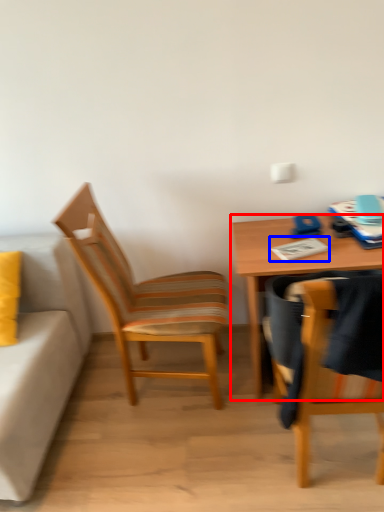
Question: Which point is closer to the camera, desk (highlighted by a red box) or notepad (highlighted by a blue box)?

Choices:
 (A) desk
 (B) notepad

Answer: (A)